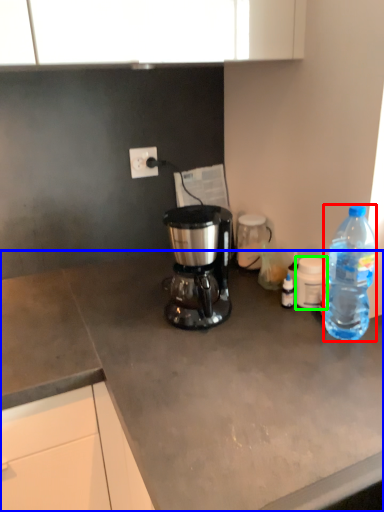
Question: Based on their relative distances, which object is nearer to bottle (highlighted by a red box)? Choose from desk (highlighted by a blue box) and coffee cup (highlighted by a green box).

Choices:
 (A) desk
 (B) coffee cup

Answer: (B)